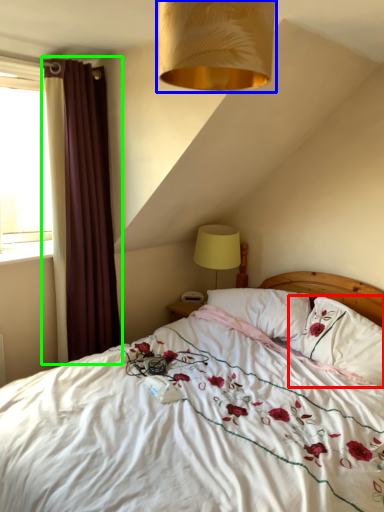
Question: Based on their relative distances, which object is nearer to pillow (highlighted by a red box)? Choose from lamp (highlighted by a blue box) and curtain (highlighted by a green box).

Choices:
 (A) lamp
 (B) curtain

Answer: (B)